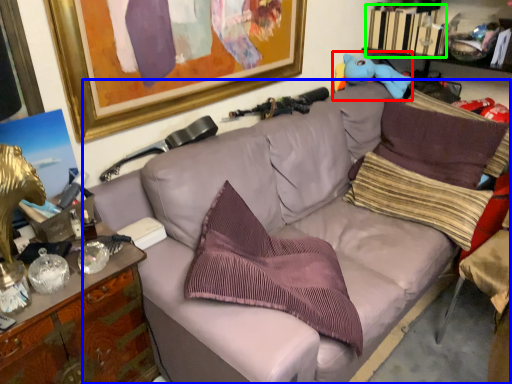
Question: Considering the real-world distances, which object is farthest from toy (highlighted by a red box)? studio couch (highlighted by a blue box) or book (highlighted by a green box)?

Choices:
 (A) studio couch
 (B) book

Answer: (A)